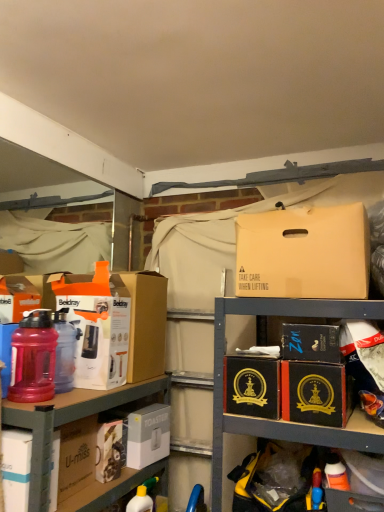
Question: Considering the relative positions of white matte toaster at lower left and black cardboard box at center, the second cardboard box in the right-to-left sequence, in the image provided, is white matte toaster at lower left to the right of black cardboard box at center, the second cardboard box in the right-to-left sequence, from the viewer's perspective?

Choices:
 (A) no
 (B) yes

Answer: (A)

Question: From the image's perspective, does white matte toaster at lower left appear lower than black cardboard box at center, the second cardboard box in the right-to-left sequence?

Choices:
 (A) no
 (B) yes

Answer: (B)

Question: Does white matte toaster at lower left have a greater width compared to black cardboard box at center, which is the 2th cardboard box from left to right?

Choices:
 (A) yes
 (B) no

Answer: (B)

Question: Is the depth of white matte toaster at lower left greater than that of black cardboard box at center, which is the 2th cardboard box from left to right?

Choices:
 (A) no
 (B) yes

Answer: (B)

Question: Can you confirm if white matte toaster at lower left is smaller than black cardboard box at center, which is the 2th cardboard box from left to right?

Choices:
 (A) yes
 (B) no

Answer: (A)

Question: Would you consider white matte toaster at lower left to be distant from black cardboard box at center, the second cardboard box in the right-to-left sequence?

Choices:
 (A) no
 (B) yes

Answer: (A)

Question: Considering the relative sizes of matte white box at left, acting as the 4th box starting from the right, and matte plastic water bottle at left, the first bottle viewed from the back, in the image provided, is matte white box at left, acting as the 4th box starting from the right, thinner than matte plastic water bottle at left, the first bottle viewed from the back,?

Choices:
 (A) yes
 (B) no

Answer: (B)

Question: From a real-world perspective, does matte white box at left, acting as the 4th box starting from the right, sit lower than matte plastic water bottle at left, the first bottle viewed from the back?

Choices:
 (A) yes
 (B) no

Answer: (B)

Question: Is matte white box at left, which is the 3th box in left-to-right order, not within matte plastic water bottle at left, the first bottle viewed from the back?

Choices:
 (A) no
 (B) yes

Answer: (B)

Question: From a real-world perspective, is matte white box at left, which is the 3th box in left-to-right order, on top of matte plastic water bottle at left, the first bottle viewed from the back?

Choices:
 (A) no
 (B) yes

Answer: (B)

Question: From the image's perspective, is matte white box at left, acting as the 4th box starting from the right, below matte plastic water bottle at left, the 2th bottle when ordered from front to back?

Choices:
 (A) yes
 (B) no

Answer: (B)

Question: Does matte white box at left, acting as the 4th box starting from the right, have a greater width compared to matte plastic water bottle at left, the 2th bottle when ordered from front to back?

Choices:
 (A) yes
 (B) no

Answer: (A)

Question: From a real-world perspective, is yellow matte bottle at lower center physically above black cardboard box at center-right, the 3th cardboard box from the left?

Choices:
 (A) no
 (B) yes

Answer: (A)